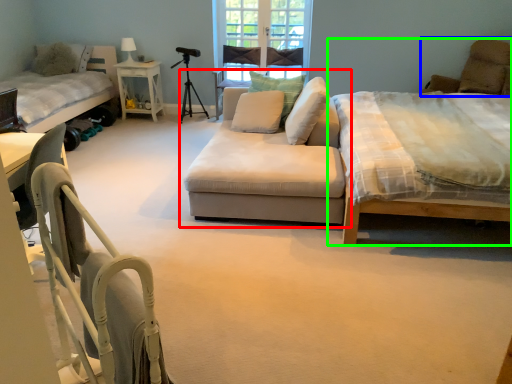
Question: Which is farther away from studio couch (highlighted by a red box)? couch (highlighted by a blue box) or bed (highlighted by a green box)?

Choices:
 (A) couch
 (B) bed

Answer: (B)